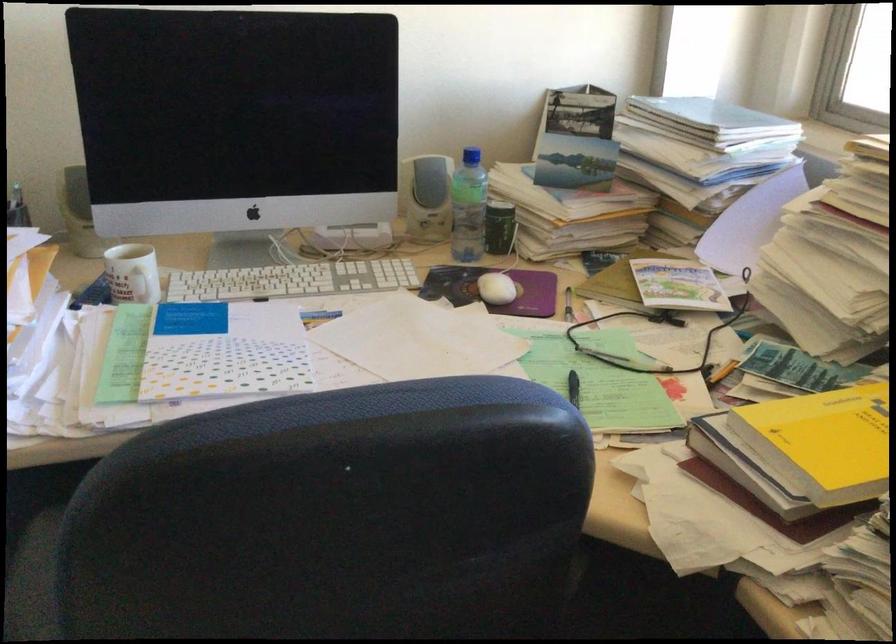
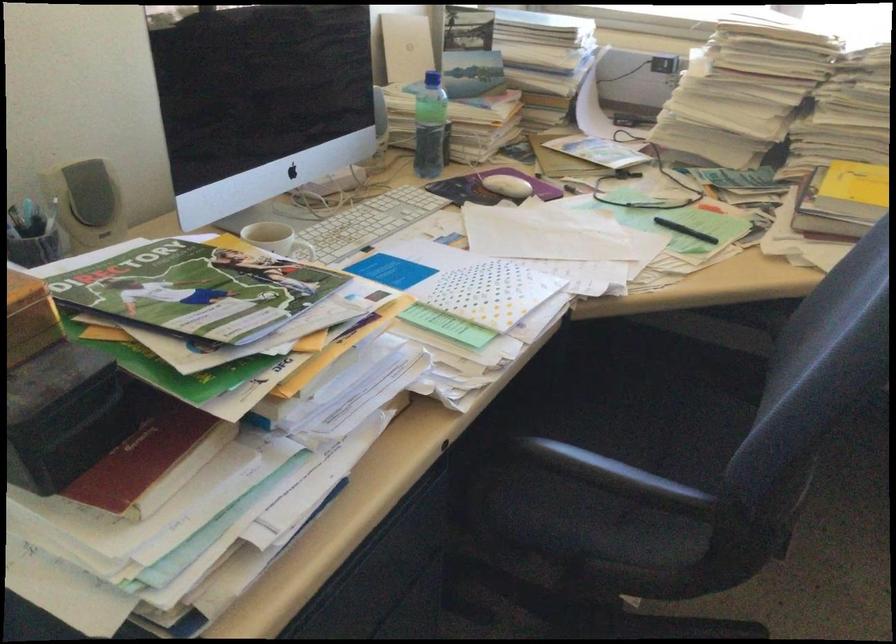
The point at [140,283] is marked in the first image. Where is the corresponding point in the second image?

(306, 252)